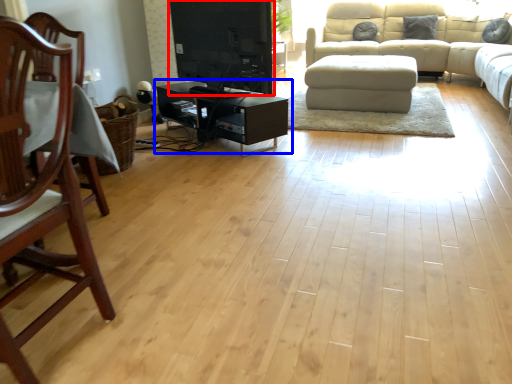
Question: Among these objects, which one is farthest to the camera, entertainment center (highlighted by a red box) or table (highlighted by a blue box)?

Choices:
 (A) entertainment center
 (B) table

Answer: (B)